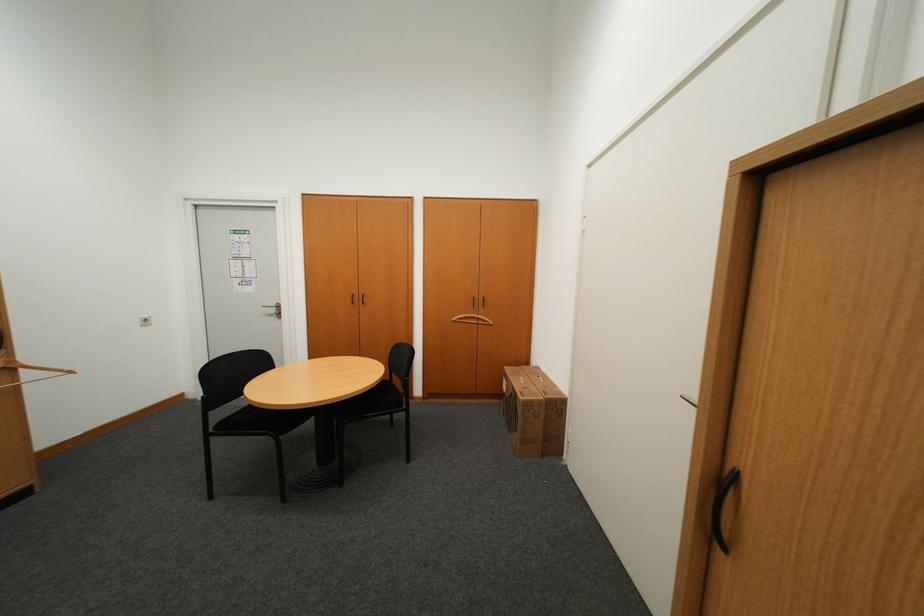
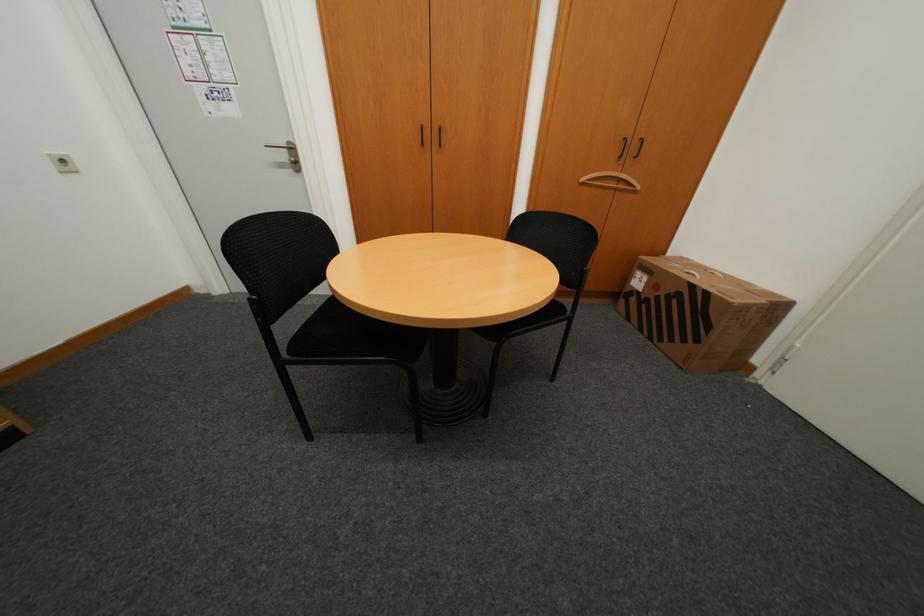
In a continuous first-person perspective shot, in which direction is the camera moving?

The cameraman walked toward left, forward.